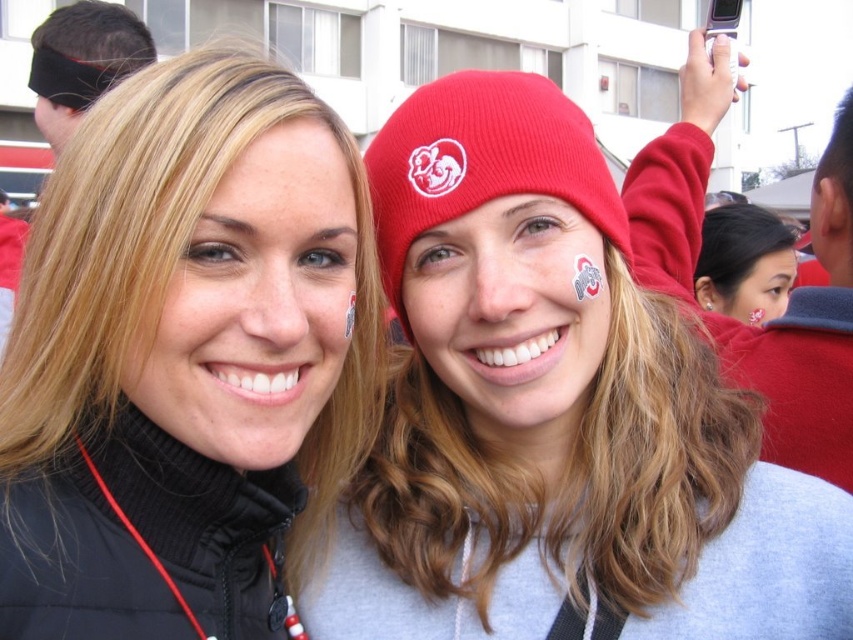
Question: Which of the following is the closest to the observer?

Choices:
 (A) matte red beanie at upper center
 (B) red knit beanie at center

Answer: (B)

Question: Which object is positioned closest to the black fleece beanie at upper left?

Choices:
 (A) matte gray hoodie at center
 (B) red knit beanie at center

Answer: (B)

Question: Can you confirm if black matte jacket at left is bigger than matte gray sweatshirt at center?

Choices:
 (A) no
 (B) yes

Answer: (B)

Question: Is matte gray hoodie at center wider than black fleece beanie at upper left?

Choices:
 (A) no
 (B) yes

Answer: (B)

Question: Which point appears closest to the camera in this image?

Choices:
 (A) (422, 173)
 (B) (848, 257)
 (C) (776, 268)
 (D) (97, 81)

Answer: (A)

Question: Is red knit beanie at center below matte gray sweatshirt at center?

Choices:
 (A) no
 (B) yes

Answer: (A)